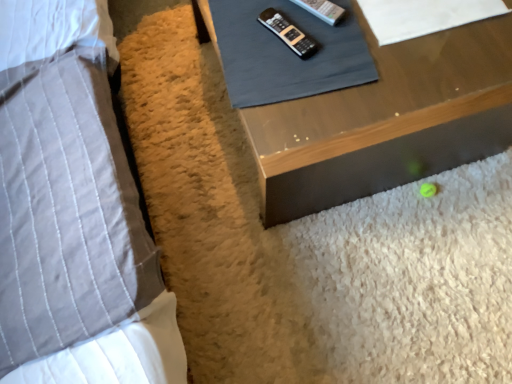
Question: In the image, is gray fabric remote control at upper center, which is the first sheet from left to right, positioned in front of or behind black plastic remote at upper center?

Choices:
 (A) behind
 (B) front

Answer: (B)

Question: From the image's perspective, is gray fabric remote control at upper center, which is the first sheet from left to right, located above or below black plastic remote at upper center?

Choices:
 (A) above
 (B) below

Answer: (A)

Question: Estimate the real-world distances between objects in this image. Which object is farther from the white paper at upper right, which is counted as the second sheet, starting from the left?

Choices:
 (A) black plastic remote at upper center
 (B) wooden table at lower right
 (C) gray fabric remote control at upper center, marked as the second sheet in a right-to-left arrangement
 (D) gray quilted pillow at left

Answer: (D)

Question: Estimate the real-world distances between objects in this image. Which object is closer to the gray quilted pillow at left?

Choices:
 (A) black plastic remote at upper center
 (B) wooden table at lower right
 (C) white paper at upper right, which is counted as the second sheet, starting from the left
 (D) gray fabric remote control at upper center, which is the first sheet from left to right

Answer: (D)